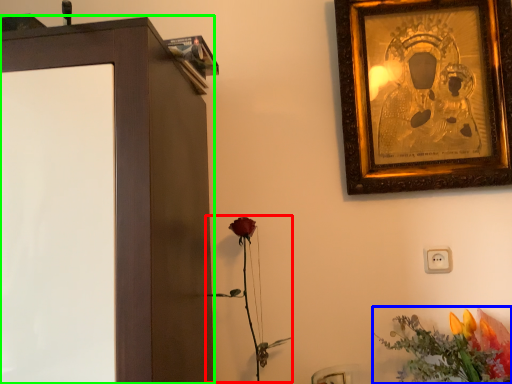
Question: Which object is positioned farthest from plant (highlighted by a red box)? Select from flower (highlighted by a blue box) and furniture (highlighted by a green box).

Choices:
 (A) flower
 (B) furniture

Answer: (A)